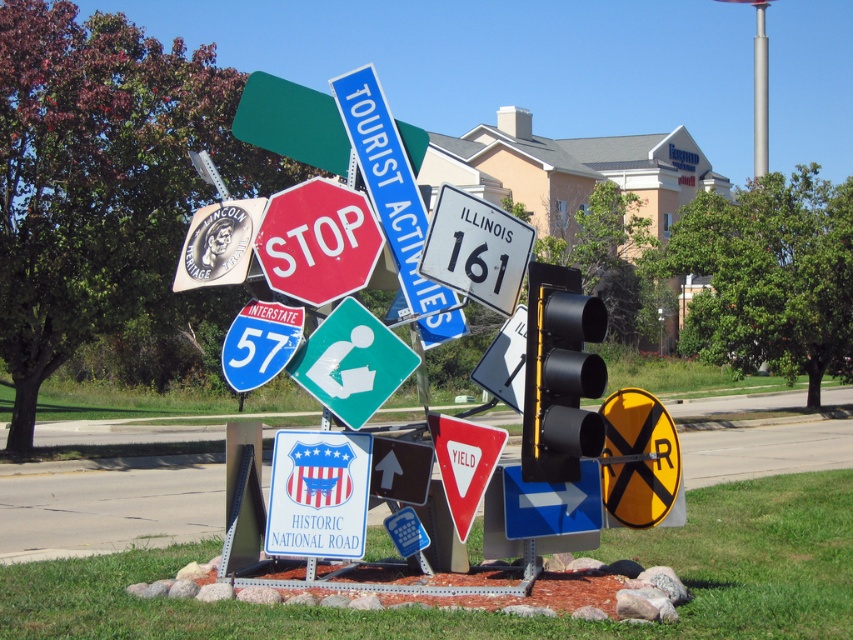
You are setting up a temporary road display and need to know which object takes up more space. Which one is larger between the blue plastic sign at center and the silver metallic pole at upper right?

The silver metallic pole at upper right is larger because the blue plastic sign at center occupies less space than it.

Based on the photo, you are standing in front of the traffic signs display and want to find the silver metallic pole at upper right. Which direction should you look relative to the blue plastic sign at center?

The silver metallic pole at upper right is to the right of the blue plastic sign at center.